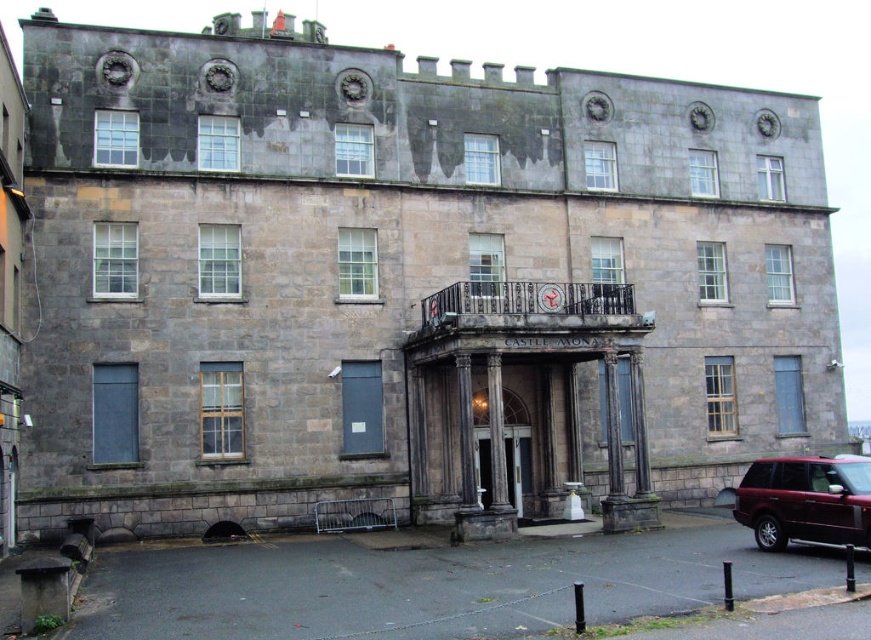
Between point (794, 512) and point (505, 456), which one is positioned behind?

The point (505, 456) is behind.

Is shiny maroon suv at lower right taller than polished stone door at center?

Yes.

Between point (801, 484) and point (483, 474), which one is positioned behind?

The point (483, 474) is behind.

Locate an element on the screen. This screenshot has width=871, height=640. shiny maroon suv at lower right is located at coordinates tap(802, 500).